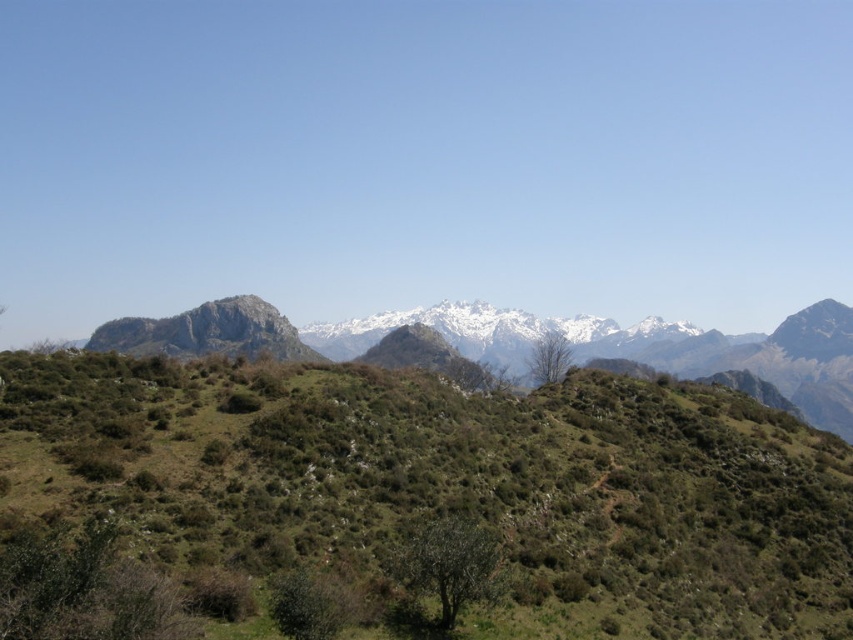
Is green grassy hill at center shorter than rugged stone mountain range at center?

Correct, green grassy hill at center is not as tall as rugged stone mountain range at center.

Describe the element at coordinates (451, 484) in the screenshot. I see `green grassy hill at center` at that location.

What do you see at coordinates (451, 484) in the screenshot? Image resolution: width=853 pixels, height=640 pixels. I see `green grassy hill at center` at bounding box center [451, 484].

The width and height of the screenshot is (853, 640). What are the coordinates of `green grassy hill at center` in the screenshot? It's located at (451, 484).

Which is more to the right, green grassy hill at center or bare branches at center?

bare branches at center is more to the right.

Can you confirm if green grassy hill at center is taller than bare branches at center?

In fact, green grassy hill at center may be shorter than bare branches at center.

Between point (553, 444) and point (556, 339), which one is positioned in front?

Point (553, 444)

This screenshot has width=853, height=640. What are the coordinates of `green grassy hill at center` in the screenshot? It's located at (451, 484).

Between rugged stone mountain range at center and green leafy tree at center, which one appears on the right side from the viewer's perspective?

rugged stone mountain range at center

Can you confirm if rugged stone mountain range at center is taller than green leafy tree at center?

Indeed, rugged stone mountain range at center has a greater height compared to green leafy tree at center.

Is point (242, 339) more distant than point (500, 576)?

Yes, point (242, 339) is farther from viewer.

The image size is (853, 640). What are the coordinates of `rugged stone mountain range at center` in the screenshot? It's located at (641, 348).